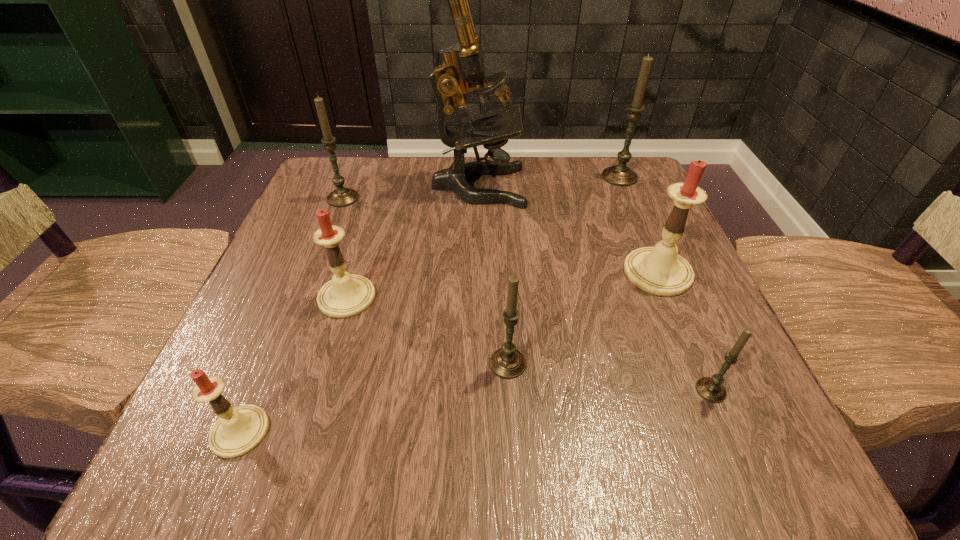
Where is `the nearest red candle`? the nearest red candle is located at coordinates (239, 430).

At what (x,y) coordinates should I click in order to perform the action: click on the nearest candle. Please return your answer as a coordinate pair (x, y). This screenshot has width=960, height=540. Looking at the image, I should click on (239, 430).

Locate an element on the screen. The image size is (960, 540). vacant space positioned at the eyepieces of the tallest object is located at coordinates (605, 186).

Identify the location of vacant region located 0.140m on the front of the farthest gray candle. The height and width of the screenshot is (540, 960). (639, 224).

You are a GUI agent. You are given a task and a screenshot of the screen. Output one action in this format:
    pyautogui.click(x=<x>, y=<y>)
    Task: Click on the free spot located on the front of the second farthest candle
    
    Given the screenshot: What is the action you would take?
    pyautogui.click(x=322, y=254)

This screenshot has width=960, height=540. I want to click on vacant position located on the back of the biggest red candle, so click(626, 197).

Find the location of `free region located 0.120m on the right of the second biggest red candle`. free region located 0.120m on the right of the second biggest red candle is located at coordinates (445, 297).

You are a GUI agent. You are given a task and a screenshot of the screen. Output one action in this format:
    pyautogui.click(x=<x>, y=<y>)
    Task: Click on the free space located 0.270m on the back of the third biggest gray candle
    Image resolution: width=960 pixels, height=540 pixels.
    Given the screenshot: What is the action you would take?
    tap(501, 238)

Where is `free space located 0.380m on the left of the smallest gray candle`? free space located 0.380m on the left of the smallest gray candle is located at coordinates (427, 390).

Identify the location of free space located 0.330m on the back of the nearest red candle. This screenshot has height=540, width=960. (315, 250).